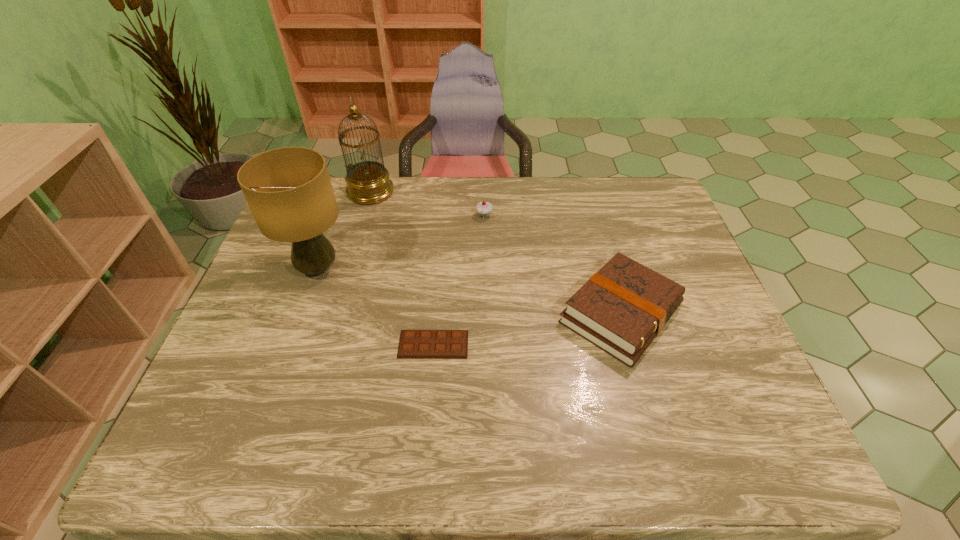
Locate an element on the screen. free space between the fourth object from left to right and the lampshade is located at coordinates (401, 242).

This screenshot has width=960, height=540. Find the location of `vacant area that lies between the chocolate bar and the fourth nearest object`. vacant area that lies between the chocolate bar and the fourth nearest object is located at coordinates (459, 280).

Where is `vacant space in between the lampshade and the shortest object`? Image resolution: width=960 pixels, height=540 pixels. vacant space in between the lampshade and the shortest object is located at coordinates (375, 307).

The image size is (960, 540). I want to click on free space that is in between the third tallest object and the hardback book, so click(552, 265).

Identify the location of vacant space in between the third tallest object and the lampshade. This screenshot has width=960, height=540. (401, 242).

Find the location of a particular element. object that stands as the second closest to the farthest object is located at coordinates (483, 208).

Identify which object is the second nearest to the lampshade. Please provide its 2D coordinates. Your answer should be formatted as a tuple, i.e. [(x, y)], where the tuple contains the x and y coordinates of a point satisfying the conditions above.

[(414, 344)]

Locate an element on the screen. free region that satisfies the following two spatial constraints: 1. on the back side of the hardback book; 2. on the left side of the chocolate bar is located at coordinates (436, 313).

The width and height of the screenshot is (960, 540). Find the location of `vacant region that satisfies the following two spatial constraints: 1. on the back side of the shortest object; 2. with an open door on the birdcage`. vacant region that satisfies the following two spatial constraints: 1. on the back side of the shortest object; 2. with an open door on the birdcage is located at coordinates (447, 192).

Where is `free space that satisfies the following two spatial constraints: 1. on the front side of the lampshade; 2. on the right side of the shortest object`? Image resolution: width=960 pixels, height=540 pixels. free space that satisfies the following two spatial constraints: 1. on the front side of the lampshade; 2. on the right side of the shortest object is located at coordinates (291, 344).